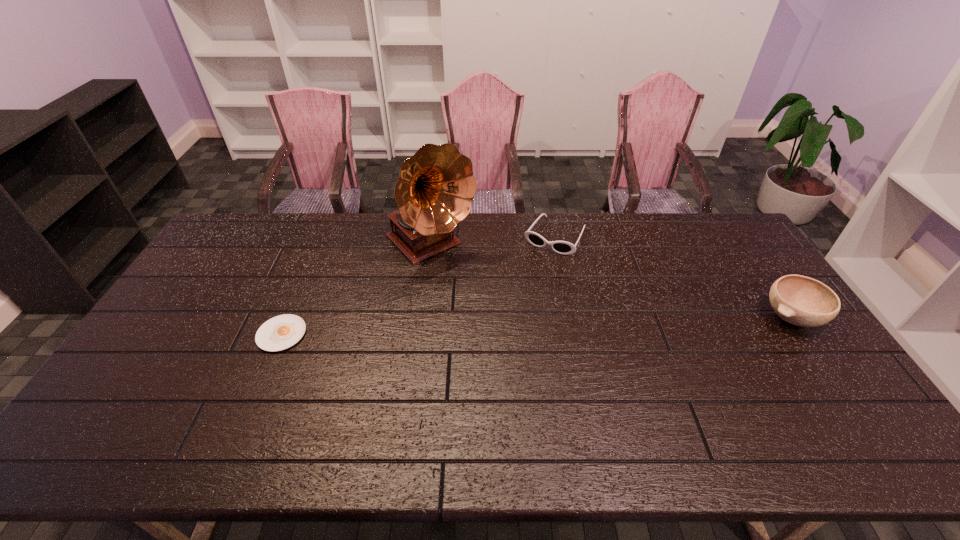
Image resolution: width=960 pixels, height=540 pixels. Identify the location of free space between the sunglasses and the second tallest object. (673, 277).

I want to click on free space between the third object from right to left and the shortest object, so click(x=356, y=289).

Where is `vacant space that is in between the egg yolk and the second shortest object`? This screenshot has height=540, width=960. vacant space that is in between the egg yolk and the second shortest object is located at coordinates (419, 285).

The height and width of the screenshot is (540, 960). Find the location of `unoccupied position between the sunglasses and the leftmost object`. unoccupied position between the sunglasses and the leftmost object is located at coordinates (419, 285).

Locate an element on the screen. Image resolution: width=960 pixels, height=540 pixels. vacant area that lies between the rightmost object and the sunglasses is located at coordinates (673, 277).

Where is `vacant point located between the second object from right to left and the phonograph_record`? The height and width of the screenshot is (540, 960). vacant point located between the second object from right to left and the phonograph_record is located at coordinates (492, 241).

Locate which object ranks in proximity to the shortest object. Please provide its 2D coordinates. Your answer should be formatted as a tuple, i.e. [(x, y)], where the tuple contains the x and y coordinates of a point satisfying the conditions above.

[(436, 186)]

The image size is (960, 540). Identify the location of object that can be found as the second closest to the tallest object. (281, 332).

Identify the location of free region that satisfies the following two spatial constraints: 1. on the front side of the second object from right to left; 2. on the left side of the third shortest object. The height and width of the screenshot is (540, 960). (571, 318).

I want to click on free spot that satisfies the following two spatial constraints: 1. on the front side of the third shortest object; 2. on the right side of the second shortest object, so click(x=571, y=318).